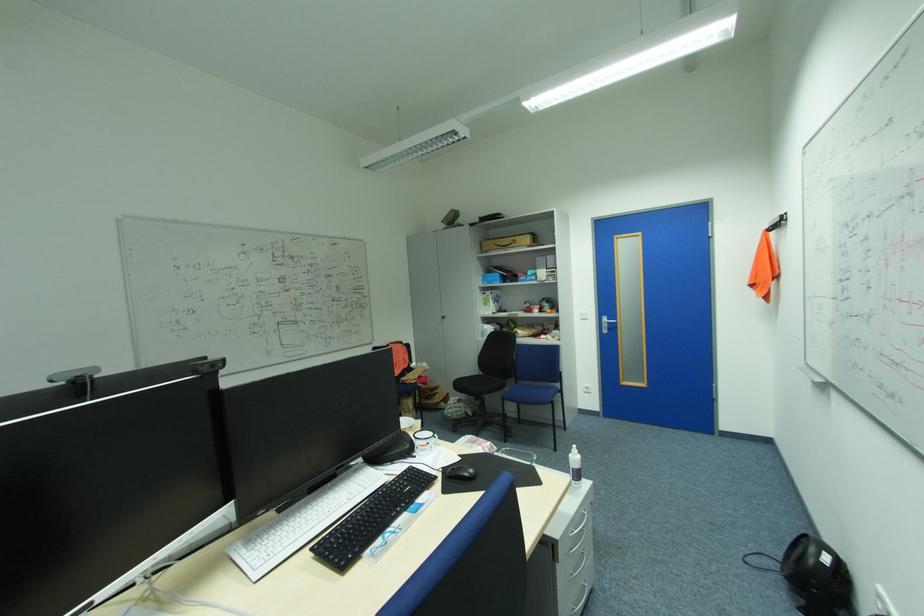
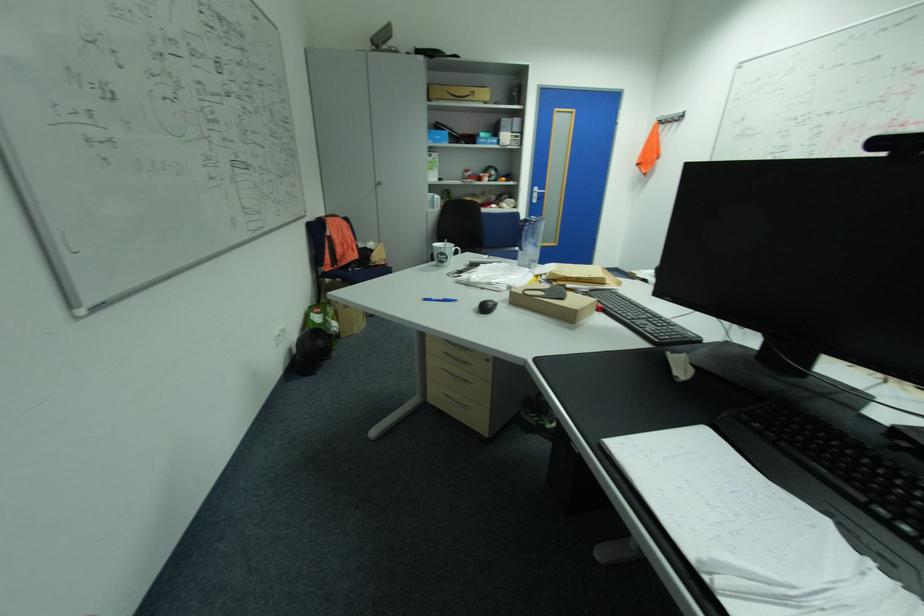
In the second image, find the point that corresponds to point 614,323 in the first image.

(544, 193)